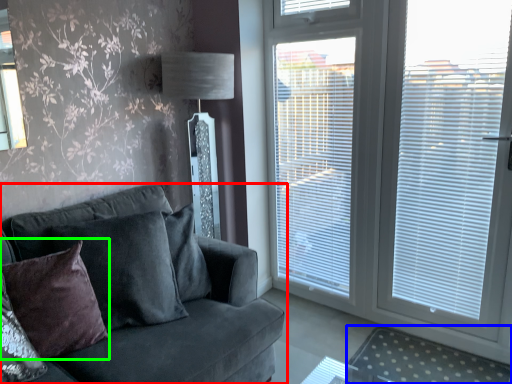
Question: Which is farther away from studio couch (highlighted by a red box)? plain (highlighted by a blue box) or pillow (highlighted by a green box)?

Choices:
 (A) plain
 (B) pillow

Answer: (A)